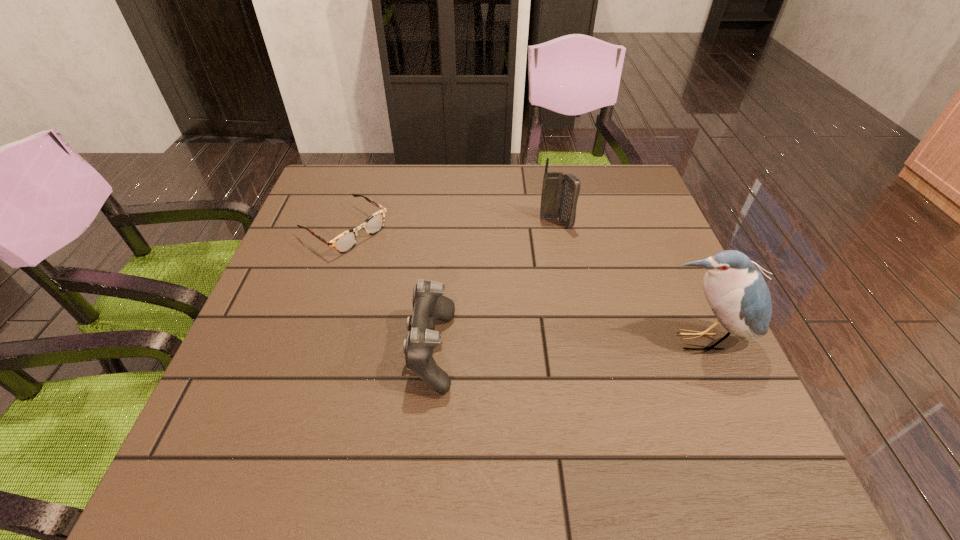
Where is `object at the right edge`? object at the right edge is located at coordinates tap(737, 293).

Find the location of a particular element. The height and width of the screenshot is (540, 960). object present at the far left corner is located at coordinates (346, 241).

Locate an element on the screen. This screenshot has height=540, width=960. free space at the far edge of the desktop is located at coordinates pyautogui.click(x=400, y=165).

The width and height of the screenshot is (960, 540). I want to click on vacant area at the near edge, so click(x=558, y=389).

The image size is (960, 540). I want to click on vacant region at the left edge, so click(x=329, y=216).

I want to click on vacant space at the right edge, so click(x=709, y=343).

Identify the location of free space at the far left corner. (321, 174).

Locate an element on the screen. This screenshot has width=960, height=540. vacant region at the near left corner is located at coordinates tap(289, 392).

Image resolution: width=960 pixels, height=540 pixels. I want to click on free region at the far right corner, so click(615, 165).

The height and width of the screenshot is (540, 960). I want to click on vacant space at the near right corner, so click(698, 390).